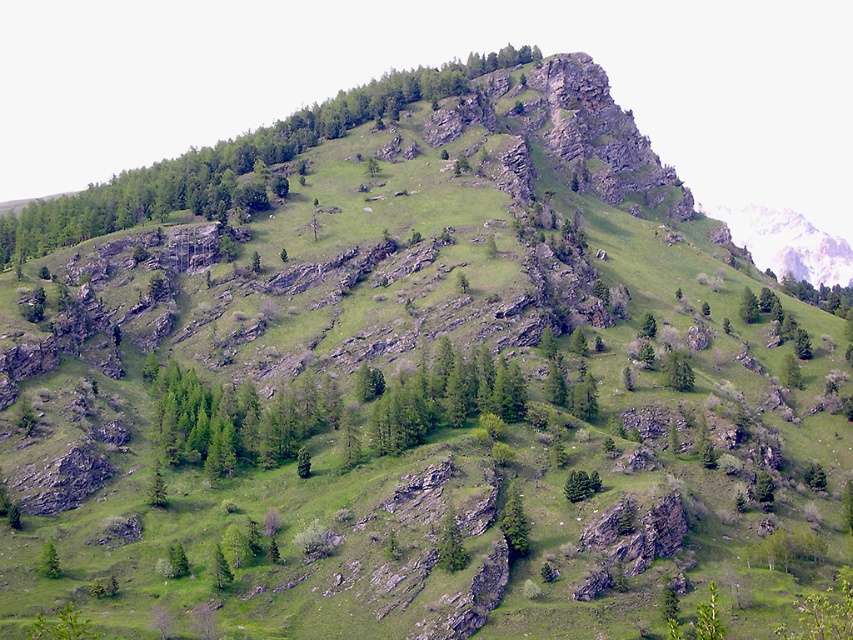
You are a hiker trying to reach the summit. You notice two trees on your path. The green leafy tree at upper center and the green matte tree at center. Which tree is closer to you as you ascend the mountain?

The green leafy tree at upper center is closer to you because the green matte tree at center is positioned behind it.

You are a hiker planning to climb the steep hillside. You notice two trees on the path ahead of you. The first is a green leafy tree at upper center, and the second is a green matte tree at center. Which tree should you aim to reach first if you want to reach higher elevation quickly?

The green leafy tree at upper center has a greater height compared to the green matte tree at center, so you should aim to reach the green leafy tree at upper center first as it is located higher up the slope.